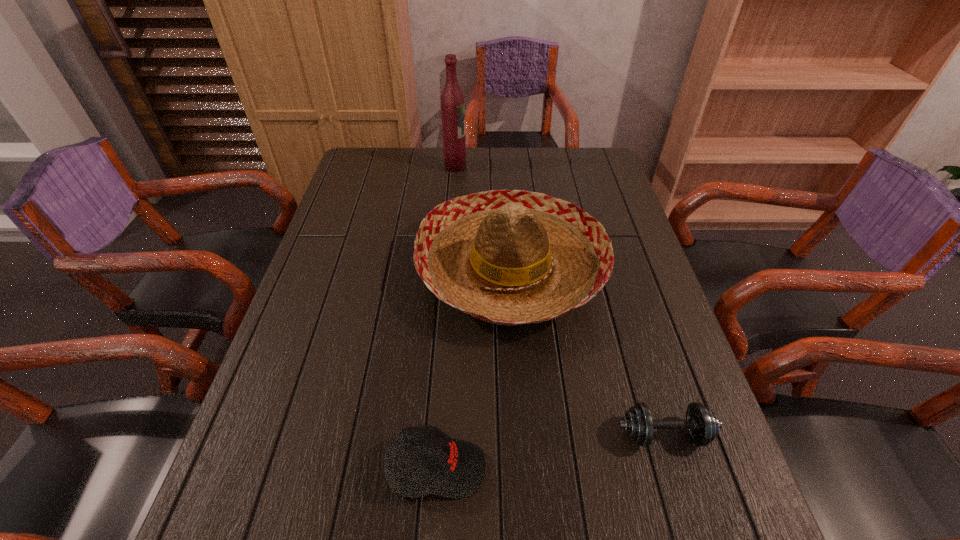
This screenshot has height=540, width=960. Find the location of `vacant space that is in between the sombrero and the baseball cap`. vacant space that is in between the sombrero and the baseball cap is located at coordinates click(x=474, y=369).

Locate an element on the screen. This screenshot has width=960, height=540. vacant region between the second shortest object and the shortest object is located at coordinates (550, 451).

Locate an element on the screen. The width and height of the screenshot is (960, 540). object that can be found as the third closest to the tallest object is located at coordinates (702, 424).

Image resolution: width=960 pixels, height=540 pixels. Find the location of `object that is the third closest to the liquor`. object that is the third closest to the liquor is located at coordinates (702, 424).

The width and height of the screenshot is (960, 540). I want to click on free space in the image that satisfies the following two spatial constraints: 1. on the label of the tallest object; 2. on the back side of the dumbbell, so click(x=436, y=434).

Locate an element on the screen. This screenshot has height=540, width=960. free location that satisfies the following two spatial constraints: 1. on the front side of the dumbbell; 2. on the front-facing side of the baseball cap is located at coordinates (675, 468).

In order to click on blank area in the image that satisfies the following two spatial constraints: 1. on the front side of the third nearest object; 2. on the left side of the dumbbell in this screenshot , I will do `click(523, 434)`.

The width and height of the screenshot is (960, 540). Find the location of `vacant region that satisfies the following two spatial constraints: 1. on the front side of the shortest object; 2. on the right side of the second tallest object`. vacant region that satisfies the following two spatial constraints: 1. on the front side of the shortest object; 2. on the right side of the second tallest object is located at coordinates pyautogui.click(x=523, y=434).

Find the location of a particular element. The image size is (960, 540). vacant area that satisfies the following two spatial constraints: 1. on the front side of the dumbbell; 2. on the front-facing side of the second shortest object is located at coordinates (675, 468).

Locate an element on the screen. This screenshot has height=540, width=960. vacant area that satisfies the following two spatial constraints: 1. on the back side of the second tallest object; 2. on the label of the farthest object is located at coordinates (504, 166).